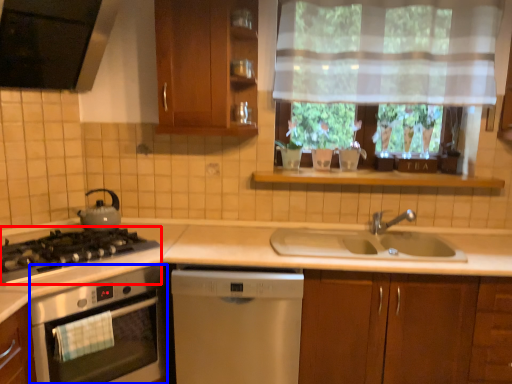
Question: Which of the following is the closest to the observer, gas stove (highlighted by a red box) or kitchen appliance (highlighted by a blue box)?

Choices:
 (A) gas stove
 (B) kitchen appliance

Answer: (B)